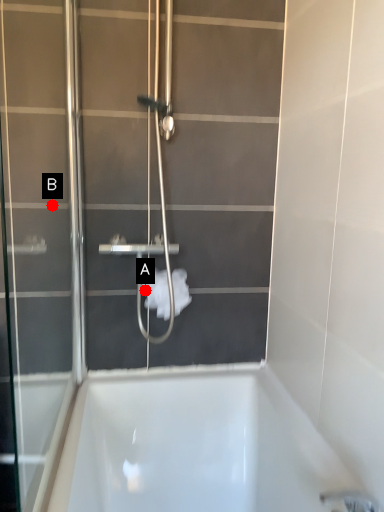
Question: Two points are circled on the image, labeled by A and B beside each circle. Which of the following is the farthest from the observer?

Choices:
 (A) A is further
 (B) B is further

Answer: (A)